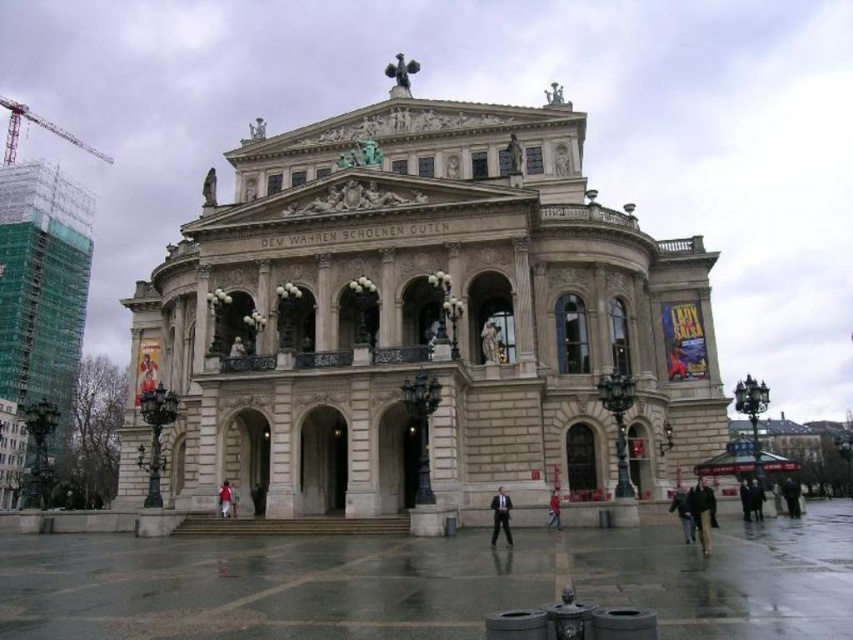
Which is behind, point (498, 525) or point (555, 528)?

The point (555, 528) is behind.

Is dark gray suit at center to the right of red fabric coat at center from the viewer's perspective?

Incorrect, dark gray suit at center is not on the right side of red fabric coat at center.

Who is more forward, (502,502) or (550,506)?

Point (502,502) is more forward.

At what (x,y) coordinates should I click in order to perform the action: click on dark gray suit at center. Please return your answer as a coordinate pair (x, y). Looking at the image, I should click on (500, 515).

Between point (28, 108) and point (555, 492), which one is positioned behind?

The point (28, 108) is behind.

You are a GUI agent. You are given a task and a screenshot of the screen. Output one action in this format:
    pyautogui.click(x=<x>, y=<y>)
    Task: Click on the orange metallic crane at upper left
    The width and height of the screenshot is (853, 640).
    Given the screenshot: What is the action you would take?
    pyautogui.click(x=39, y=125)

Which is more to the right, dark gray suit at center or white fabric person at center?

dark gray suit at center is more to the right.

The height and width of the screenshot is (640, 853). What are the coordinates of `dark gray suit at center` in the screenshot? It's located at (500, 515).

At what (x,y) coordinates should I click in order to perform the action: click on dark gray suit at center. Please return your answer as a coordinate pair (x, y). This screenshot has width=853, height=640. Looking at the image, I should click on (500, 515).

In order to click on dark gray suit at center in this screenshot , I will do `click(500, 515)`.